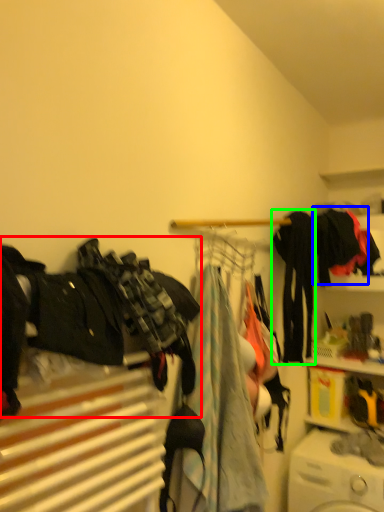
Question: Considering the real-world distances, which object is farthest from clothing (highlighted by a red box)? clothing (highlighted by a blue box) or clothing (highlighted by a green box)?

Choices:
 (A) clothing
 (B) clothing

Answer: (A)